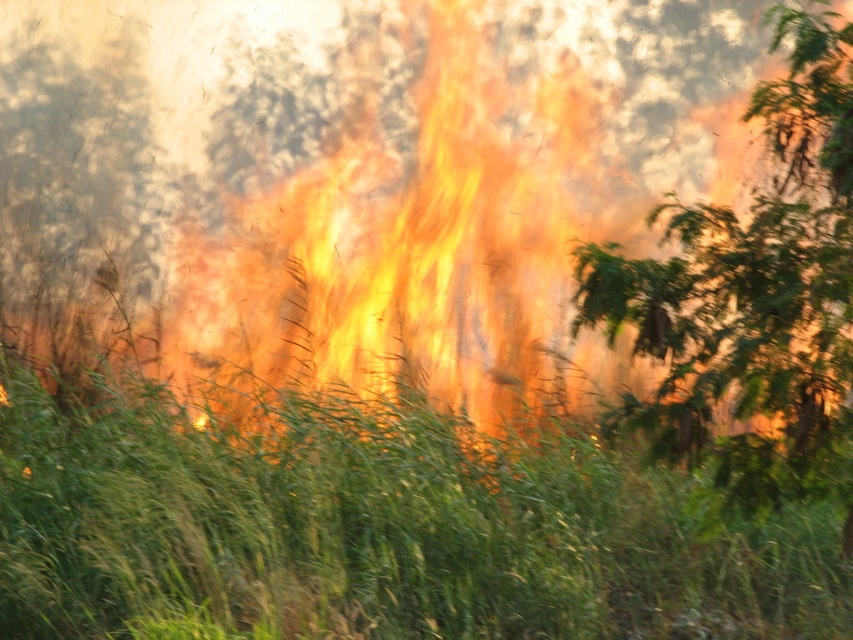
Is flame-like at center bigger than green leafy tree at left?

Yes.

Between point (328, 225) and point (141, 129), which one is positioned behind?

Point (328, 225)

This screenshot has width=853, height=640. What are the coordinates of `flame-like at center` in the screenshot? It's located at (412, 243).

Who is positioned more to the left, green grass at center or green leafy tree at center?

green grass at center

Does point (122, 632) lie behind point (798, 54)?

Yes, point (122, 632) is behind point (798, 54).

Describe the element at coordinates (370, 531) in the screenshot. I see `green grass at center` at that location.

Where is `green grass at center`? green grass at center is located at coordinates (370, 531).

Does green grass at center have a larger size compared to green leafy tree at left?

Yes.

Does green grass at center have a greater width compared to green leafy tree at left?

Yes, green grass at center is wider than green leafy tree at left.

Who is more forward, (341, 464) or (38, 150)?

Point (341, 464) is in front.

This screenshot has height=640, width=853. In order to click on green grass at center in this screenshot , I will do `click(370, 531)`.